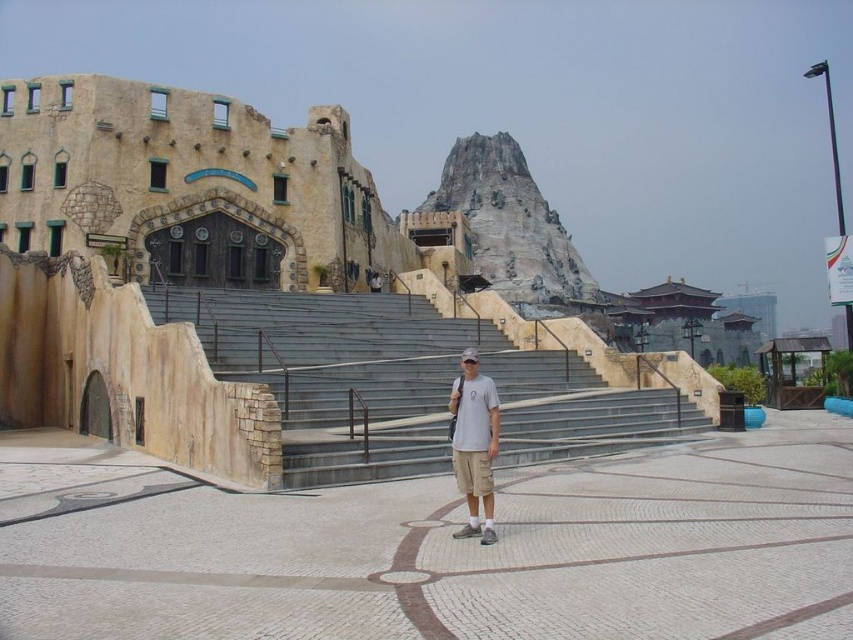
Question: Does concrete stairs at center have a lesser width compared to white cotton t-shirt at center?

Choices:
 (A) no
 (B) yes

Answer: (A)

Question: Which point is farther to the camera?

Choices:
 (A) (421, 404)
 (B) (490, 273)

Answer: (B)

Question: Is concrete stairs at center to the left of rocky gray at center from the viewer's perspective?

Choices:
 (A) yes
 (B) no

Answer: (A)

Question: Which object is positioned farthest from the concrete stairs at center?

Choices:
 (A) rocky gray at center
 (B) white cotton t-shirt at center

Answer: (A)

Question: Which object is farther from the camera taking this photo?

Choices:
 (A) rocky gray at center
 (B) concrete stairs at center
 (C) white cotton t-shirt at center

Answer: (A)

Question: Does concrete stairs at center have a larger size compared to rocky gray at center?

Choices:
 (A) yes
 (B) no

Answer: (B)